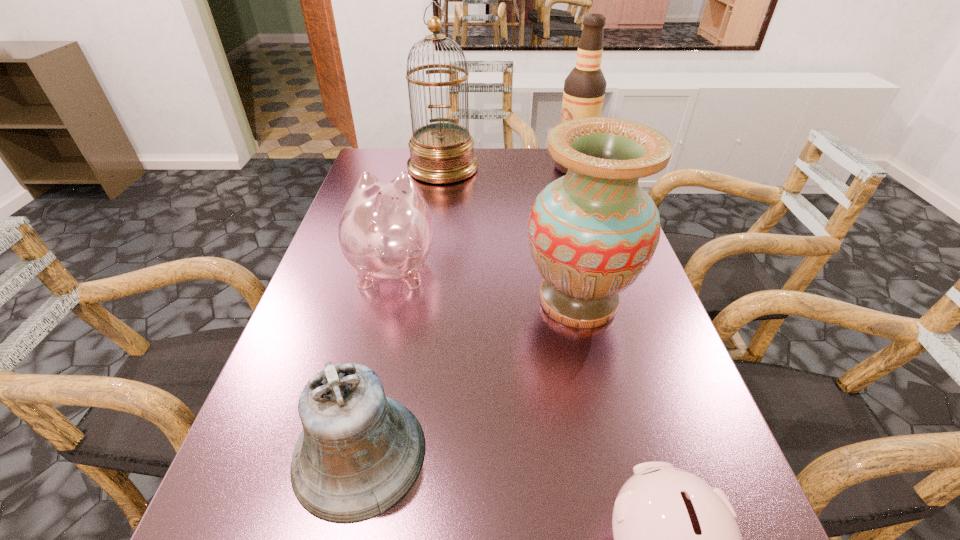
Find the location of `alcohol situated at the right edge`. alcohol situated at the right edge is located at coordinates (584, 88).

This screenshot has width=960, height=540. In order to click on vase that is at the right edge in this screenshot , I will do `click(592, 233)`.

The image size is (960, 540). In order to click on object present at the far left corner in this screenshot , I will do `click(440, 152)`.

This screenshot has width=960, height=540. Find the location of `object positioned at the far right corner`. object positioned at the far right corner is located at coordinates (584, 88).

Where is `vacant space at the far edge of the desktop`? This screenshot has height=540, width=960. vacant space at the far edge of the desktop is located at coordinates (514, 161).

Image resolution: width=960 pixels, height=540 pixels. Find the location of `vacant space at the left edge of the desktop`. vacant space at the left edge of the desktop is located at coordinates (348, 278).

Identify the location of vacant space at the right edge of the desktop. This screenshot has height=540, width=960. (641, 350).

The image size is (960, 540). I want to click on blank space at the far left corner of the desktop, so (390, 150).

The image size is (960, 540). What are the coordinates of `free space at the far right corner of the desktop` in the screenshot? It's located at (550, 167).

This screenshot has width=960, height=540. I want to click on free area in between the birdcage and the bell, so click(401, 310).